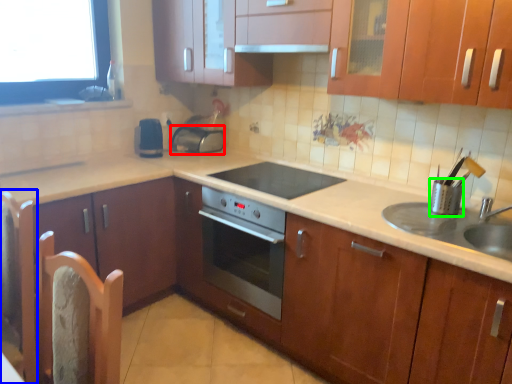
Question: Which object is positioned farthest from appliance (highlighted by a red box)? Select from chair (highlighted by a blue box) and appliance (highlighted by a green box).

Choices:
 (A) chair
 (B) appliance

Answer: (B)